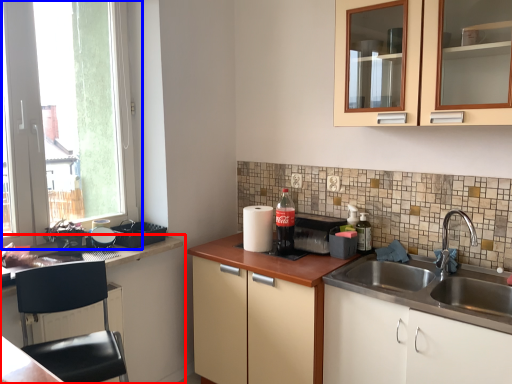
Question: Which object is closer to the camera taking this photo, cabinetry (highlighted by a red box) or window (highlighted by a blue box)?

Choices:
 (A) cabinetry
 (B) window

Answer: (A)